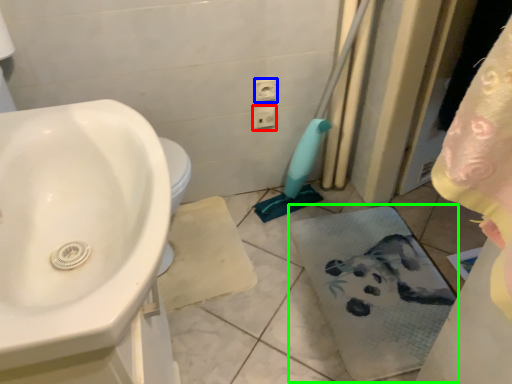
Question: Which object is positioned farthest from electric outlet (highlighted by a red box)? Select from electric outlet (highlighted by a blue box) and bath towel (highlighted by a green box).

Choices:
 (A) electric outlet
 (B) bath towel

Answer: (B)